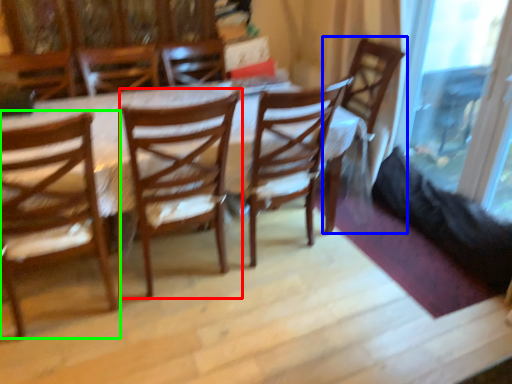
Question: Which object is positioned closest to chair (highlighted by a red box)? Select from chair (highlighted by a blue box) and chair (highlighted by a green box).

Choices:
 (A) chair
 (B) chair

Answer: (B)